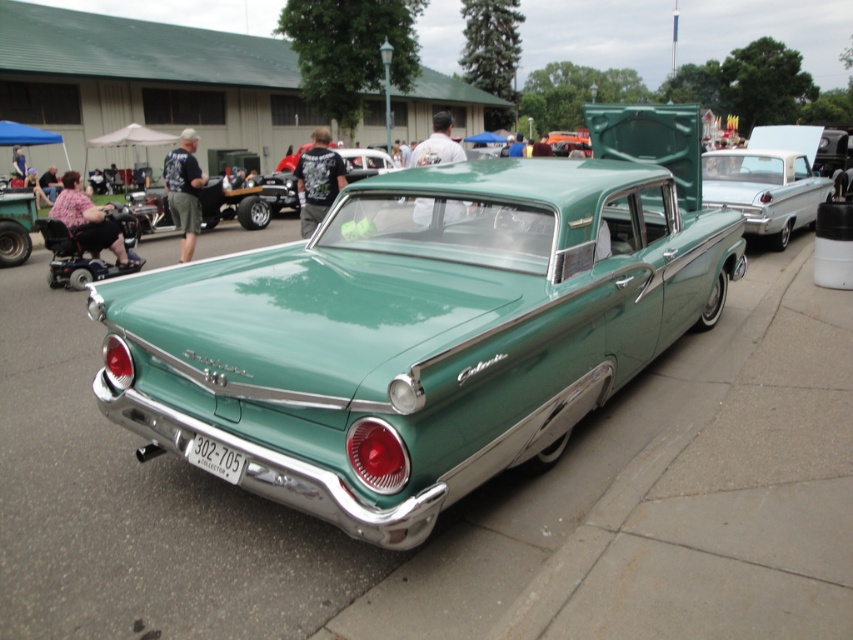
Question: Is shiny silver sedan at center above white plastic license plate at lower center?

Choices:
 (A) yes
 (B) no

Answer: (A)

Question: Estimate the real-world distances between objects in this image. Which object is closer to the white plastic license plate at lower center?

Choices:
 (A) shiny silver sedan at center
 (B) green metallic sedan at center

Answer: (B)

Question: Which is nearer to the white plastic license plate at lower center?

Choices:
 (A) shiny silver sedan at center
 (B) green metallic sedan at center

Answer: (B)

Question: Considering the relative positions of shiny silver sedan at center and green metallic sedan at center in the image provided, where is shiny silver sedan at center located with respect to green metallic sedan at center?

Choices:
 (A) left
 (B) right

Answer: (B)

Question: Which point is closer to the camera?

Choices:
 (A) shiny silver sedan at center
 (B) green metallic sedan at center
 (C) white plastic license plate at lower center

Answer: (C)

Question: Does shiny silver sedan at center have a smaller size compared to green metallic sedan at center?

Choices:
 (A) yes
 (B) no

Answer: (A)